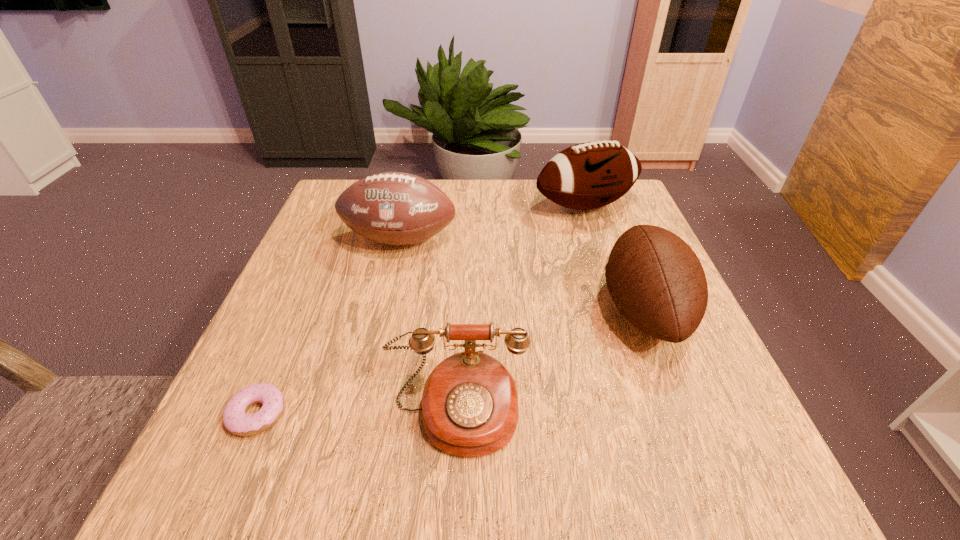
Locate an element on the screen. The image size is (960, 540). the leftmost football is located at coordinates (394, 208).

Locate an element on the screen. Image resolution: width=960 pixels, height=540 pixels. the nearest football is located at coordinates (655, 279).

Locate an element on the screen. This screenshot has width=960, height=540. the fourth tallest object is located at coordinates (470, 408).

Where is `doughnut`? The width and height of the screenshot is (960, 540). doughnut is located at coordinates (235, 419).

Find the location of a particular element. vacant region located 0.330m on the right of the leftmost football is located at coordinates [x=595, y=240].

Locate an element on the screen. The image size is (960, 540). free space located 0.150m on the laces of the third farthest object is located at coordinates (526, 310).

The height and width of the screenshot is (540, 960). I want to click on free space located on the laces of the third farthest object, so click(x=441, y=310).

Where is `free space located 0.190m on the laces of the third farthest object`? This screenshot has width=960, height=540. free space located 0.190m on the laces of the third farthest object is located at coordinates (506, 310).

You are a GUI agent. You are given a task and a screenshot of the screen. Output one action in this format:
    pyautogui.click(x=<x>, y=<y>)
    Task: Click on the free point located on the dial of the second shortest object
    The width and height of the screenshot is (960, 540).
    Given the screenshot: What is the action you would take?
    (453, 502)

Where is `free location located on the right of the doughnut`? free location located on the right of the doughnut is located at coordinates (524, 414).